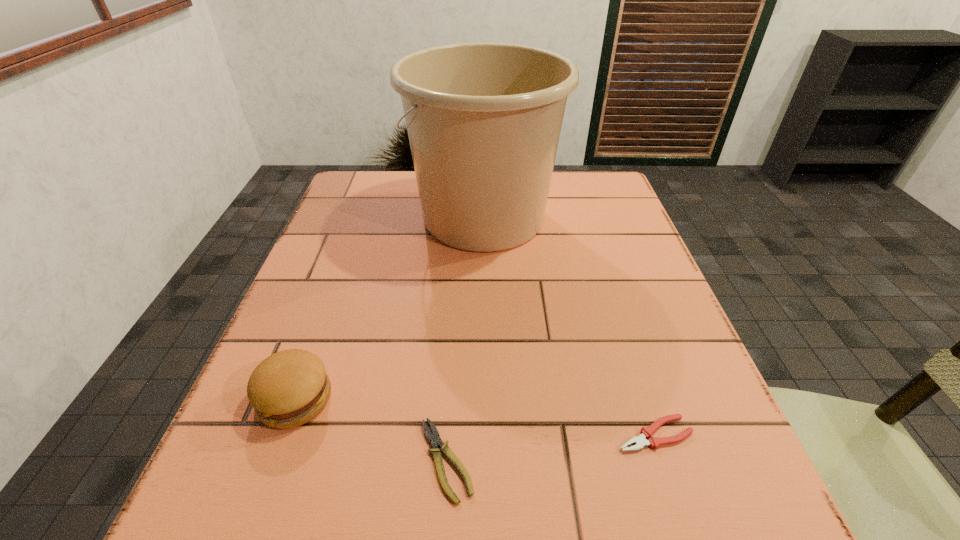
You are a GUI agent. You are given a task and a screenshot of the screen. Output one action in this format:
    pyautogui.click(x=<x>, y=<y>)
    Task: Click on the vacant region at the near right corner of the desktop
    
    Given the screenshot: What is the action you would take?
    pyautogui.click(x=657, y=508)

Find the location of `unoccupied area between the hamburger and the right pliers`. unoccupied area between the hamburger and the right pliers is located at coordinates (475, 416).

Locate an element on the screen. Image resolution: width=960 pixels, height=540 pixels. free spot between the leftmost object and the left pliers is located at coordinates (371, 429).

Find the location of `free space between the tallest object and the hamburger`. free space between the tallest object and the hamburger is located at coordinates (390, 308).

At what (x,y) coordinates should I click in order to perform the action: click on blank region between the farthest object and the third shortest object. Please return your answer as a coordinate pair (x, y). The width and height of the screenshot is (960, 540). Looking at the image, I should click on 390,308.

You are a GUI agent. You are given a task and a screenshot of the screen. Output one action in this format:
    pyautogui.click(x=<x>, y=<y>)
    Task: Click on the vacant space that's between the tallest object and the right pliers
    
    Given the screenshot: What is the action you would take?
    pyautogui.click(x=569, y=326)

Locate an element on the screen. The image size is (960, 540). blank region between the second tallest object and the left pliers is located at coordinates (371, 429).

At what (x,y) coordinates should I click in order to perform the action: click on vacant point located between the third shortest object and the farthest object. Please return your answer as a coordinate pair (x, y). The image size is (960, 540). Looking at the image, I should click on (390, 308).

Where is `free spot between the left pliers and the leftmost object`? The height and width of the screenshot is (540, 960). free spot between the left pliers and the leftmost object is located at coordinates [371, 429].

Image resolution: width=960 pixels, height=540 pixels. Identify the location of vacant space that's between the rightmost object and the left pliers. (550, 447).